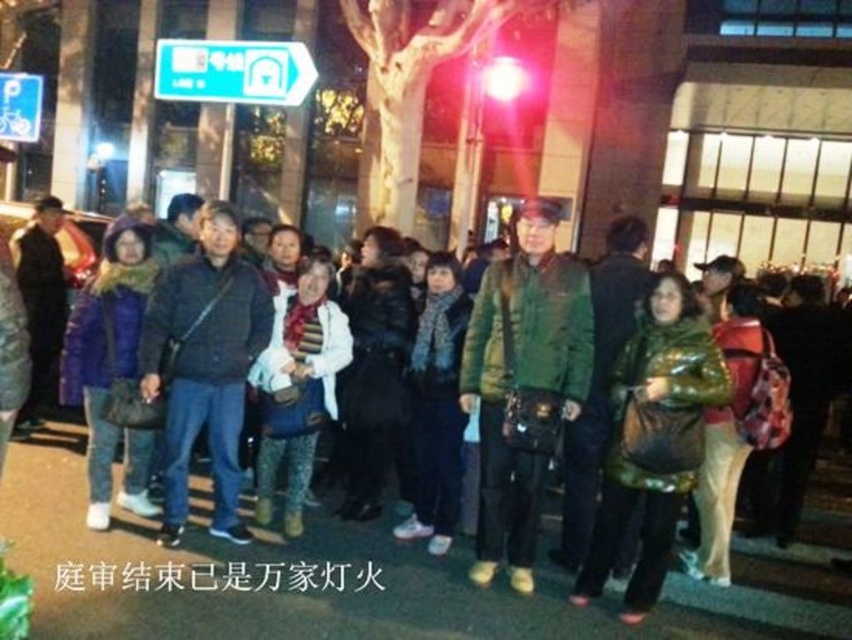
Is point (484, 572) in front of point (217, 452)?

Yes, it is in front of point (217, 452).

Is point (471, 362) positioned after point (225, 442)?

Yes, point (471, 362) is behind point (225, 442).

This screenshot has height=640, width=852. I want to click on green quilted jacket at center, so click(x=522, y=385).

Can you confirm if green matte jacket at center is positioned above green quilted jacket at center?

Incorrect, green matte jacket at center is not positioned above green quilted jacket at center.

The height and width of the screenshot is (640, 852). What do you see at coordinates (248, 570) in the screenshot?
I see `green matte jacket at center` at bounding box center [248, 570].

I want to click on green matte jacket at center, so click(248, 570).

From the picture: Is dark blue jeans at center closer to camera compared to green plastic sign at upper left?

Yes, it is in front of green plastic sign at upper left.

Which of these two, dark blue jeans at center or green plastic sign at upper left, stands shorter?

With less height is green plastic sign at upper left.

At what (x,y) coordinates should I click in order to perform the action: click on dark blue jeans at center. Please return your answer as a coordinate pair (x, y). The width and height of the screenshot is (852, 640). Looking at the image, I should click on (205, 365).

The width and height of the screenshot is (852, 640). Find the location of `dark blue jeans at center`. dark blue jeans at center is located at coordinates (205, 365).